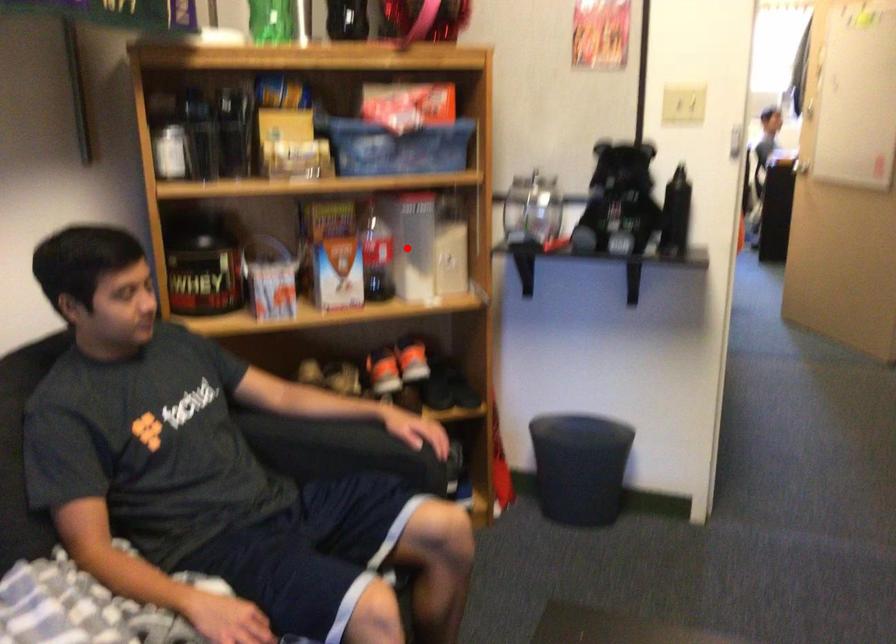
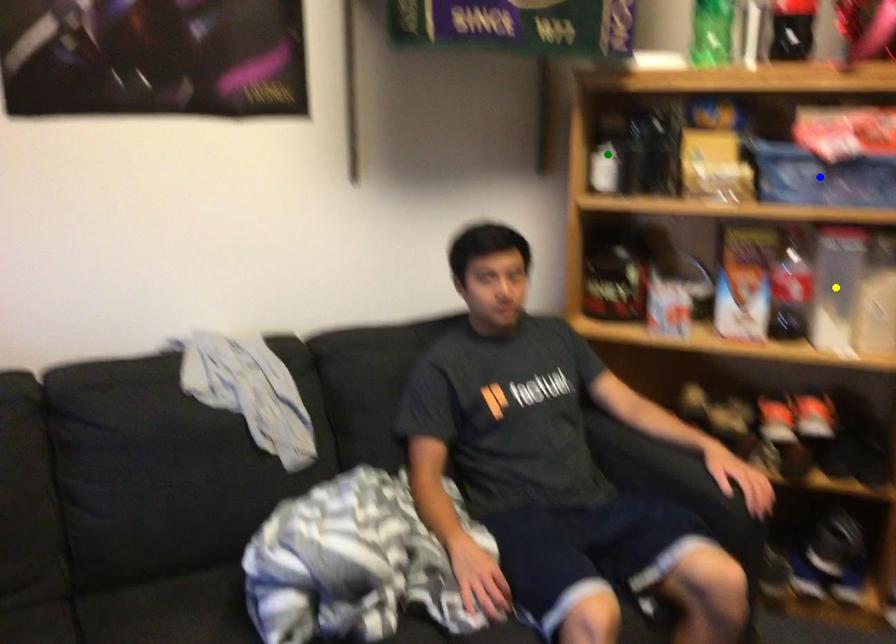
Question: I am providing you with two images of the same scene from different viewpoints. A red point is marked on the first image. You are given multiple points on the second image. Can you choose the point in image 2 that corresponds to the point in image 1?

Choices:
 (A) blue point
 (B) green point
 (C) yellow point

Answer: (C)